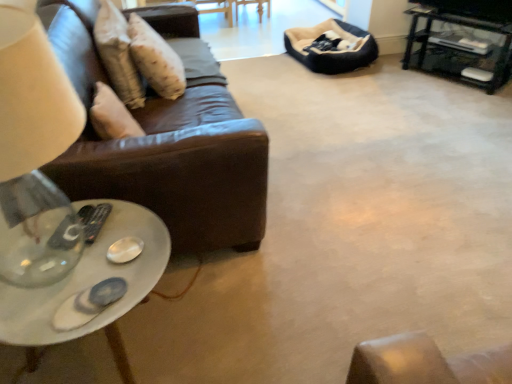
Question: Is black metal tv stand at upper right oriented towards white glossy coffee table at lower left?

Choices:
 (A) no
 (B) yes

Answer: (B)

Question: Is black metal tv stand at upper right thinner than white glossy coffee table at lower left?

Choices:
 (A) yes
 (B) no

Answer: (B)

Question: From a real-world perspective, is black metal tv stand at upper right under white glossy coffee table at lower left?

Choices:
 (A) no
 (B) yes

Answer: (A)

Question: From the image's perspective, does black metal tv stand at upper right appear lower than white glossy coffee table at lower left?

Choices:
 (A) no
 (B) yes

Answer: (A)

Question: Could white glossy coffee table at lower left be considered to be inside black metal tv stand at upper right?

Choices:
 (A) no
 (B) yes

Answer: (A)

Question: In the image, is beige textured pillow at upper left on the left side or the right side of white glossy coffee table at lower left?

Choices:
 (A) right
 (B) left

Answer: (B)

Question: From a real-world perspective, is beige textured pillow at upper left above or below white glossy coffee table at lower left?

Choices:
 (A) above
 (B) below

Answer: (A)

Question: Is beige textured pillow at upper left taller or shorter than white glossy coffee table at lower left?

Choices:
 (A) tall
 (B) short

Answer: (A)

Question: In terms of width, does beige textured pillow at upper left look wider or thinner when compared to white glossy coffee table at lower left?

Choices:
 (A) wide
 (B) thin

Answer: (B)

Question: Is white glossy coffee table at lower left taller or shorter than beige textured pillow at upper left?

Choices:
 (A) short
 (B) tall

Answer: (A)

Question: Considering their positions, is white glossy coffee table at lower left located in front of or behind beige textured pillow at upper left?

Choices:
 (A) front
 (B) behind

Answer: (A)

Question: Considering the relative positions of white glossy coffee table at lower left and beige textured pillow at upper left in the image provided, is white glossy coffee table at lower left to the left or to the right of beige textured pillow at upper left?

Choices:
 (A) right
 (B) left

Answer: (A)

Question: Considering the positions of white glossy coffee table at lower left and beige textured pillow at upper left in the image, is white glossy coffee table at lower left wider or thinner than beige textured pillow at upper left?

Choices:
 (A) wide
 (B) thin

Answer: (A)

Question: Relative to black plastic remote at lower left, is transparent glass table lamp at left in front or behind?

Choices:
 (A) front
 (B) behind

Answer: (A)

Question: Based on their positions, is transparent glass table lamp at left located to the left or right of black plastic remote at lower left?

Choices:
 (A) left
 (B) right

Answer: (A)